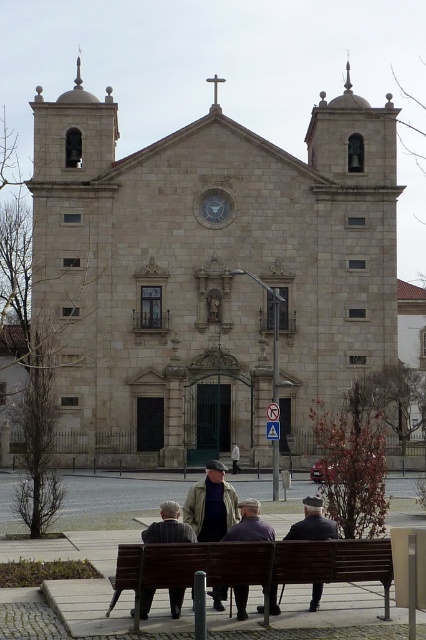
You are a delivery person standing at the entrance of the historic stone church. You need to place a package between the dark brown leather jacket at lower center and the dark gray fabric jacket at center. Can you fit the package if it requires 3 meters of space between the two jackets?

The dark brown leather jacket at lower center and dark gray fabric jacket at center are 3.56 meters apart from each other, so yes, the package can be placed between them as the distance is sufficient.

You are a visitor at the church entrance and want to sit down. You see the brown wooden bench at lower center and the dark gray fabric jacket at center. Which object is shorter and can you sit on it?

The brown wooden bench at lower center is shorter than the dark gray fabric jacket at center. However, the dark gray fabric jacket at center is likely an item of clothing and not meant for sitting. The bench is designed for sitting, so you should sit on the brown wooden bench at lower center.

You are standing in front of the historic stone church and want to determine the relative positions of two points marked on the facade. Which point is closer to you, point at coordinate (252, 540) or point at coordinate (296, 531)?

Point at coordinate (252, 540) is closer to the viewer than point at coordinate (296, 531).